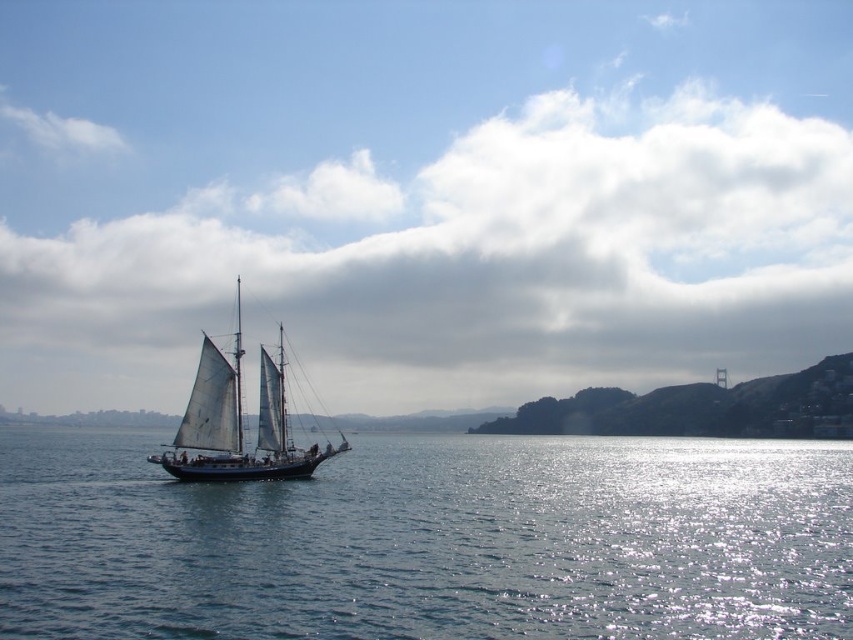
Question: Which of the following is the farthest from the observer?

Choices:
 (A) pyautogui.click(x=239, y=348)
 (B) pyautogui.click(x=570, y=116)
 (C) pyautogui.click(x=431, y=556)

Answer: (B)

Question: Which point is closer to the camera?

Choices:
 (A) white sailboat at center
 (B) blue water at center
 (C) white fluffy cloud at upper center

Answer: (B)

Question: Does blue water at center appear on the left side of white sailboat at center?

Choices:
 (A) no
 (B) yes

Answer: (B)

Question: Does white fluffy cloud at upper center have a larger size compared to blue water at center?

Choices:
 (A) yes
 (B) no

Answer: (A)

Question: Which of these objects is positioned closest to the blue water at center?

Choices:
 (A) white sailboat at center
 (B) white fluffy cloud at upper center

Answer: (A)

Question: Is blue water at center in front of white sailboat at center?

Choices:
 (A) yes
 (B) no

Answer: (A)